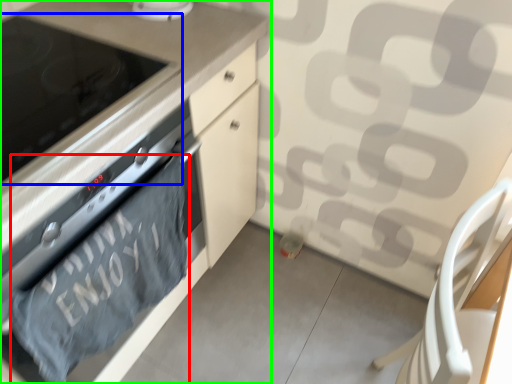
Question: Considering the real-world distances, which object is farthest from bath towel (highlighted by a red box)? home appliance (highlighted by a blue box) or cabinetry (highlighted by a green box)?

Choices:
 (A) home appliance
 (B) cabinetry

Answer: (A)